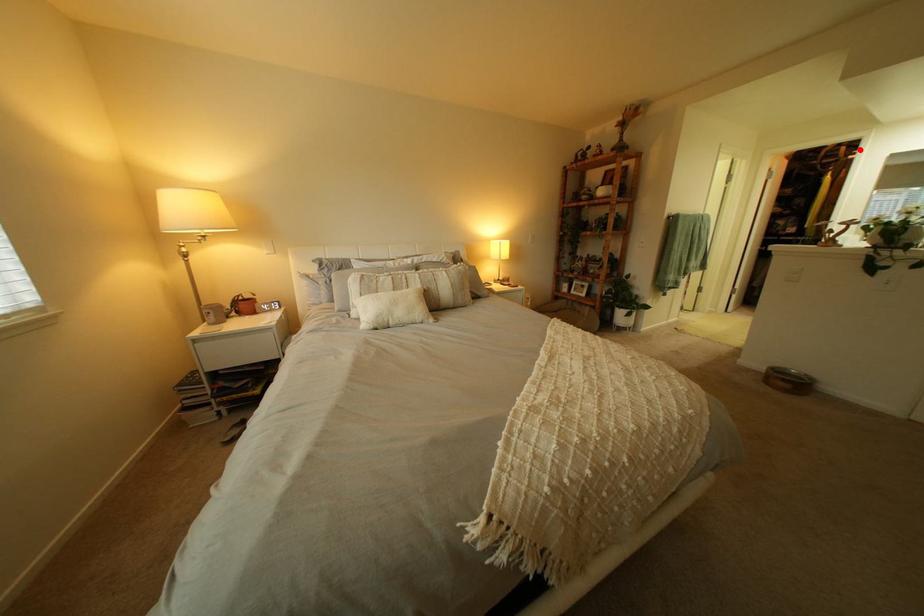
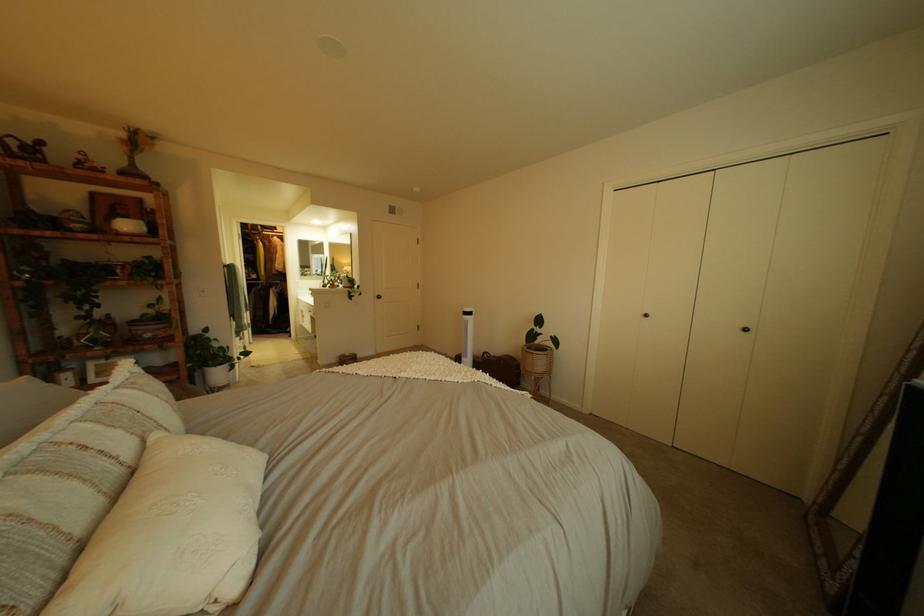
The point at the highlighted location is marked in the first image. Where is the corresponding point in the second image?

(274, 228)